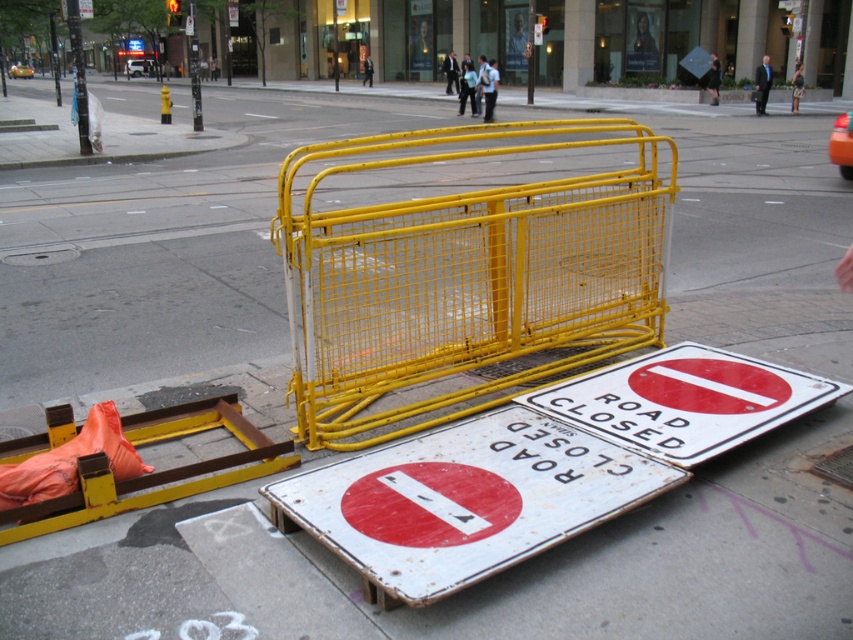
Question: Does yellow metal fence at center have a lesser width compared to orange fabric barricade at lower left?

Choices:
 (A) yes
 (B) no

Answer: (B)

Question: Which point appears farthest from the camera in this image?

Choices:
 (A) (97, 480)
 (B) (368, 460)

Answer: (B)

Question: Which object is farther from the camera taking this photo?

Choices:
 (A) orange fabric barricade at lower left
 (B) yellow metal fence at center

Answer: (B)

Question: Which object appears closest to the camera in this image?

Choices:
 (A) orange fabric barricade at lower left
 (B) rusty metal road closed sign at center
 (C) yellow metal fence at center

Answer: (B)

Question: Is yellow metal fence at center thinner than orange fabric barricade at lower left?

Choices:
 (A) yes
 (B) no

Answer: (B)

Question: Is rusty metal road closed sign at center below orange fabric barricade at lower left?

Choices:
 (A) yes
 (B) no

Answer: (A)